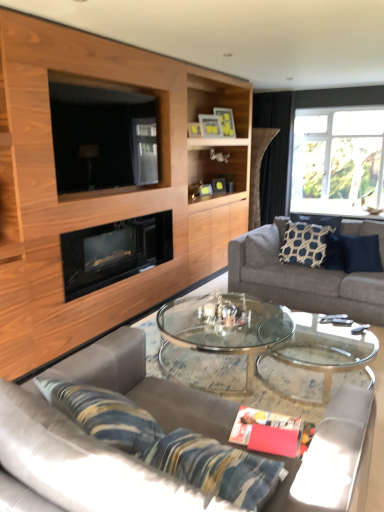
Question: Does matte yellow picture frame at upper center, arranged as the 3th picture frame when viewed from the front, come behind gray fabric couch at right, the 1th studio couch when ordered from back to front?

Choices:
 (A) no
 (B) yes

Answer: (B)

Question: Is gray fabric couch at right, the 1th studio couch when ordered from back to front, inside matte yellow picture frame at upper center, arranged as the 3th picture frame when viewed from the front?

Choices:
 (A) yes
 (B) no

Answer: (B)

Question: Would you say matte yellow picture frame at upper center, marked as the first picture frame in a back-to-front arrangement, is outside gray fabric couch at right, which appears as the 2th studio couch when viewed from the left?

Choices:
 (A) no
 (B) yes

Answer: (B)

Question: Is matte yellow picture frame at upper center, marked as the first picture frame in a back-to-front arrangement, positioned in front of gray fabric couch at right, the 1th studio couch when ordered from back to front?

Choices:
 (A) no
 (B) yes

Answer: (A)

Question: Considering the relative sizes of matte yellow picture frame at upper center, arranged as the 3th picture frame when viewed from the front, and gray fabric couch at right, arranged as the first studio couch when viewed from the right, in the image provided, is matte yellow picture frame at upper center, arranged as the 3th picture frame when viewed from the front, smaller than gray fabric couch at right, arranged as the first studio couch when viewed from the right,?

Choices:
 (A) yes
 (B) no

Answer: (A)

Question: From a real-world perspective, relative to navy blue textured pillow at right, which appears as the 2th pillow when viewed from the right, is black fabric curtain at upper right vertically above or below?

Choices:
 (A) below
 (B) above

Answer: (B)

Question: Considering the positions of black fabric curtain at upper right and navy blue textured pillow at right, which appears as the 2th pillow when viewed from the right, in the image, is black fabric curtain at upper right bigger or smaller than navy blue textured pillow at right, which appears as the 2th pillow when viewed from the right,?

Choices:
 (A) small
 (B) big

Answer: (B)

Question: From the image's perspective, is black fabric curtain at upper right positioned above or below navy blue textured pillow at right, which appears as the 2th pillow when viewed from the right?

Choices:
 (A) below
 (B) above

Answer: (B)

Question: Is point (266, 117) positioned closer to the camera than point (319, 224)?

Choices:
 (A) closer
 (B) farther

Answer: (B)

Question: From the image's perspective, relative to clear glass window at upper right, is matte yellow picture frame at upper center, arranged as the 3th picture frame when viewed from the front, above or below?

Choices:
 (A) above
 (B) below

Answer: (A)

Question: From a real-world perspective, is matte yellow picture frame at upper center, marked as the first picture frame in a back-to-front arrangement, physically located above or below clear glass window at upper right?

Choices:
 (A) below
 (B) above

Answer: (B)

Question: Would you say matte yellow picture frame at upper center, arranged as the 3th picture frame when viewed from the front, is inside or outside clear glass window at upper right?

Choices:
 (A) outside
 (B) inside

Answer: (A)

Question: Is matte yellow picture frame at upper center, marked as the first picture frame in a back-to-front arrangement, in front of or behind clear glass window at upper right in the image?

Choices:
 (A) front
 (B) behind

Answer: (A)

Question: Do you think clear glass window at upper right is within wooden cabinet at upper left, or outside of it?

Choices:
 (A) inside
 (B) outside

Answer: (B)

Question: Considering the positions of clear glass window at upper right and wooden cabinet at upper left in the image, is clear glass window at upper right bigger or smaller than wooden cabinet at upper left?

Choices:
 (A) big
 (B) small

Answer: (B)